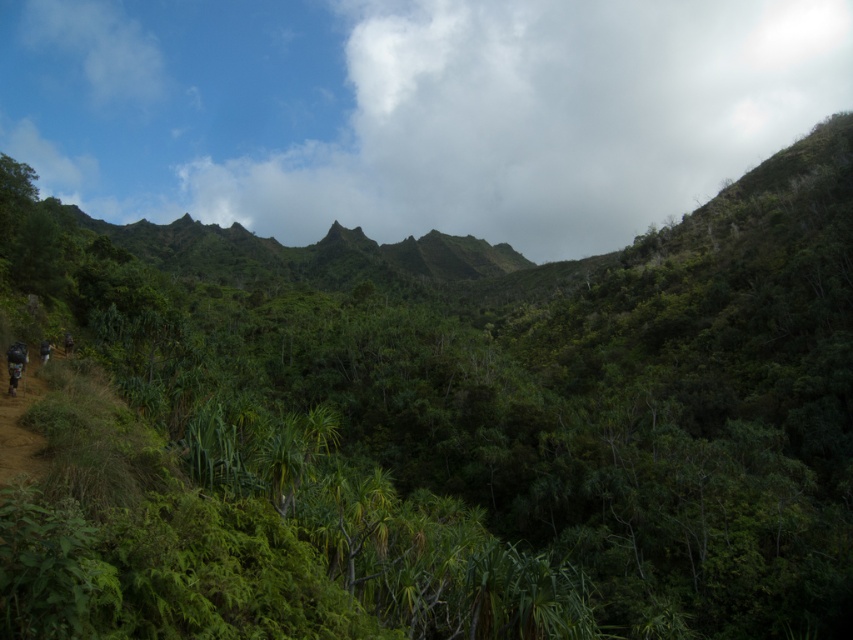
Who is more distant from viewer, (497,120) or (20,348)?

Point (497,120)

Does cloudy sky at upper center appear on the left side of camouflage fabric mountain biker at lower left?

In fact, cloudy sky at upper center is to the right of camouflage fabric mountain biker at lower left.

Who is more distant from viewer, (491, 179) or (22, 344)?

The point (491, 179) is more distant.

Find the location of a particular element. The width and height of the screenshot is (853, 640). cloudy sky at upper center is located at coordinates (538, 120).